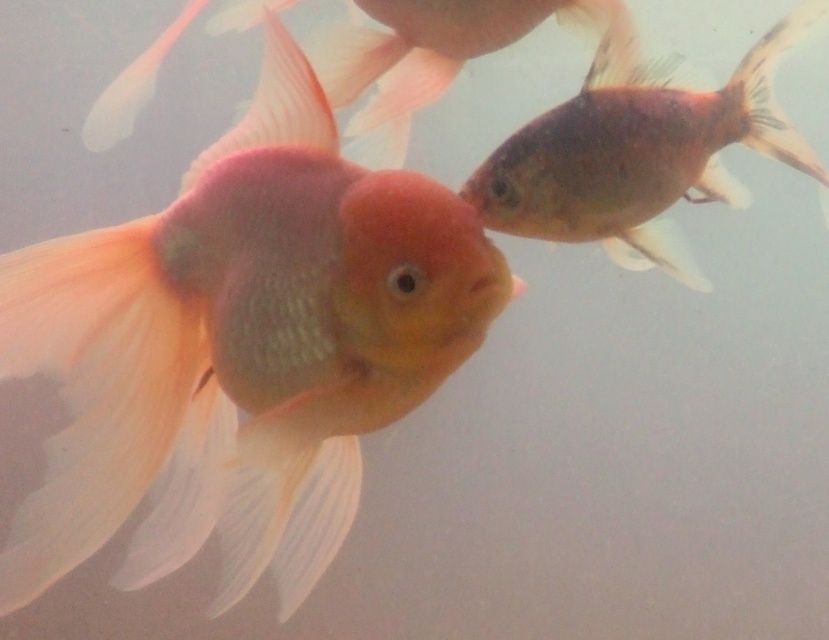
Question: Is matte goldfish at left wider than shiny metallic fish at upper right?

Choices:
 (A) yes
 (B) no

Answer: (A)

Question: Does matte goldfish at left have a greater width compared to shiny metallic fish at upper right?

Choices:
 (A) yes
 (B) no

Answer: (A)

Question: Does matte goldfish at left lie behind shiny metallic fish at upper right?

Choices:
 (A) no
 (B) yes

Answer: (A)

Question: Which point is closer to the camera taking this photo?

Choices:
 (A) (54, 564)
 (B) (555, 230)

Answer: (A)